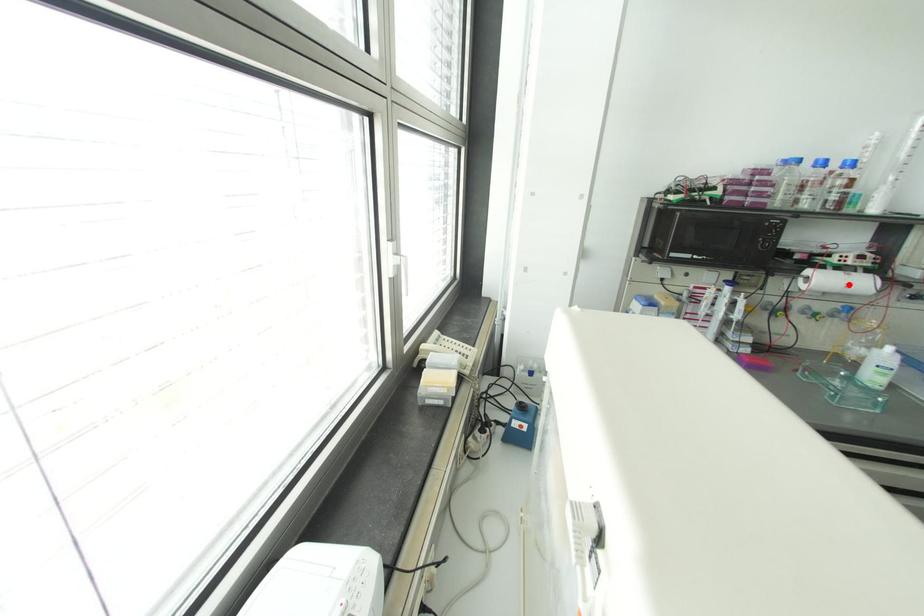
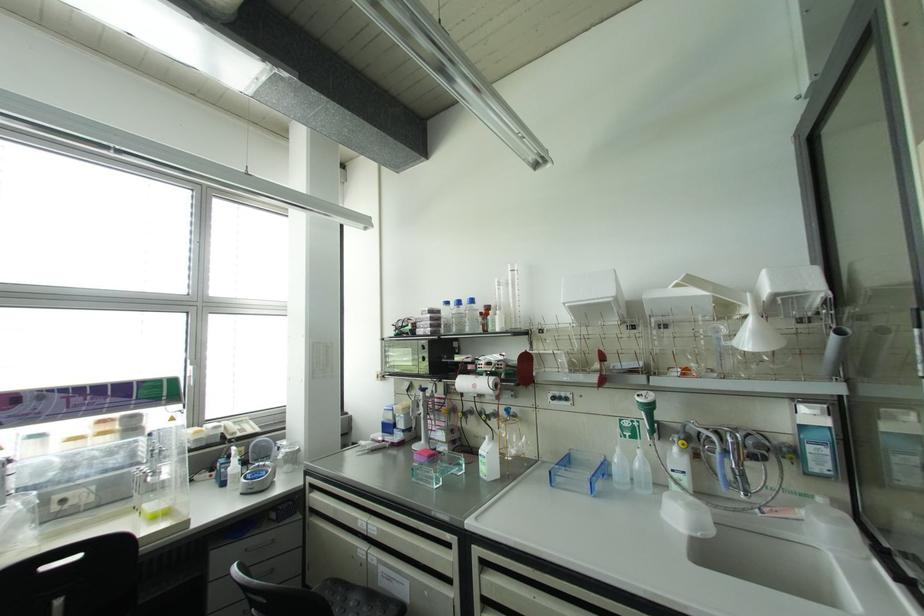
Where in the second image is the point corresponding to the highlighted location from the first image?

(473, 386)